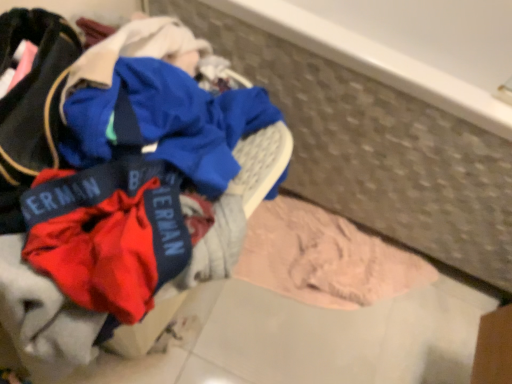
Question: From the image's perspective, is red fabric laundry at center below pink soft fabric at lower right?

Choices:
 (A) yes
 (B) no

Answer: (B)

Question: Does red fabric laundry at center have a lesser width compared to pink soft fabric at lower right?

Choices:
 (A) yes
 (B) no

Answer: (B)

Question: Is red fabric laundry at center at the left side of pink soft fabric at lower right?

Choices:
 (A) yes
 (B) no

Answer: (A)

Question: Is red fabric laundry at center to the right of pink soft fabric at lower right from the viewer's perspective?

Choices:
 (A) yes
 (B) no

Answer: (B)

Question: Is red fabric laundry at center wider than pink soft fabric at lower right?

Choices:
 (A) yes
 (B) no

Answer: (A)

Question: Can you confirm if red fabric laundry at center is taller than pink soft fabric at lower right?

Choices:
 (A) yes
 (B) no

Answer: (A)

Question: Would you consider pink soft fabric at lower right to be distant from red fabric laundry at center?

Choices:
 (A) yes
 (B) no

Answer: (B)

Question: Are pink soft fabric at lower right and red fabric laundry at center making contact?

Choices:
 (A) yes
 (B) no

Answer: (B)

Question: Is pink soft fabric at lower right positioned with its back to red fabric laundry at center?

Choices:
 (A) yes
 (B) no

Answer: (B)

Question: Could you tell me if pink soft fabric at lower right is facing red fabric laundry at center?

Choices:
 (A) yes
 (B) no

Answer: (B)

Question: From the image's perspective, would you say pink soft fabric at lower right is shown under red fabric laundry at center?

Choices:
 (A) yes
 (B) no

Answer: (A)

Question: Considering the relative sizes of pink soft fabric at lower right and red fabric laundry at center in the image provided, is pink soft fabric at lower right taller than red fabric laundry at center?

Choices:
 (A) no
 (B) yes

Answer: (A)

Question: From their relative heights in the image, would you say red fabric laundry at center is taller or shorter than pink soft fabric at lower right?

Choices:
 (A) tall
 (B) short

Answer: (A)